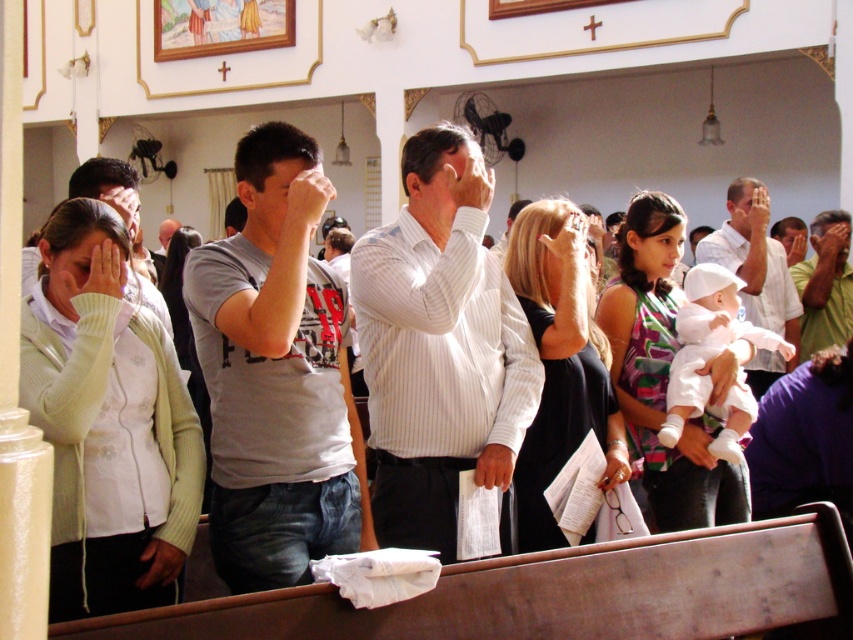
Between point (432, 147) and point (712, 344), which one is positioned behind?

Point (712, 344)

Describe the element at coordinates (440, 348) in the screenshot. I see `white striped shirt at center` at that location.

Which is behind, point (408, 220) or point (712, 307)?

The point (712, 307) is more distant.

I want to click on white striped shirt at center, so click(440, 348).

Does gray cotton t-shirt at center have a lesser width compared to green cotton shirt at center?

No.

Who is shorter, gray cotton t-shirt at center or green cotton shirt at center?

Standing shorter between the two is green cotton shirt at center.

Does point (196, 339) lie behind point (798, 352)?

That is False.

Identify the location of gray cotton t-shirt at center. (277, 376).

Which of these two, white cotton baby at center or white cotton shirt at center, stands taller?

With more height is white cotton baby at center.

In the scene shown: Can you confirm if white cotton baby at center is thinner than white cotton shirt at center?

No, white cotton baby at center is not thinner than white cotton shirt at center.

Where is `white cotton baby at center`? This screenshot has width=853, height=640. white cotton baby at center is located at coordinates (706, 340).